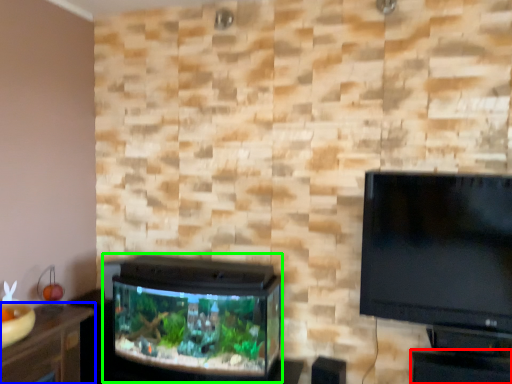
Question: Which object is positioned farthest from table (highlighted by a red box)? Select from furniture (highlighted by a blue box) and tv cabinet (highlighted by a green box).

Choices:
 (A) furniture
 (B) tv cabinet

Answer: (A)